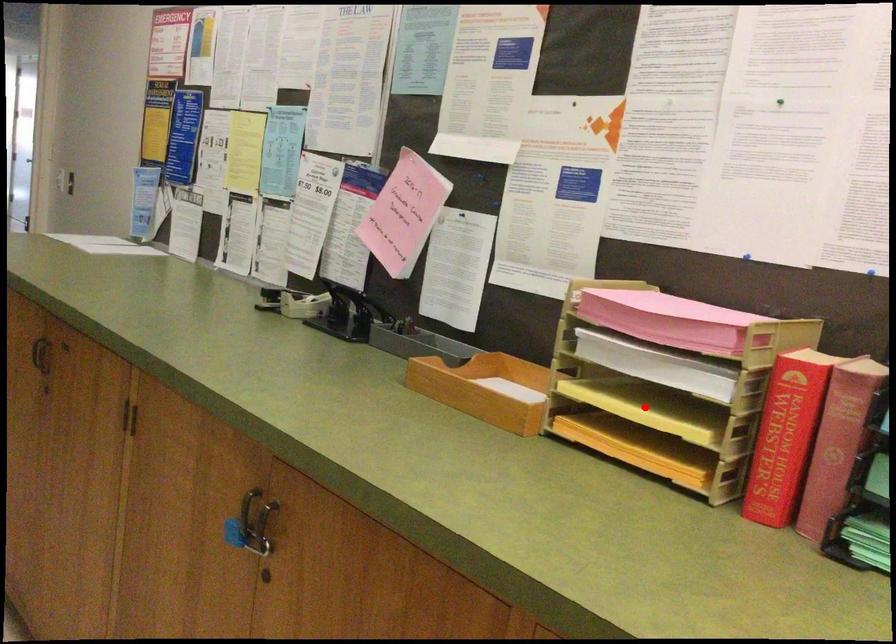
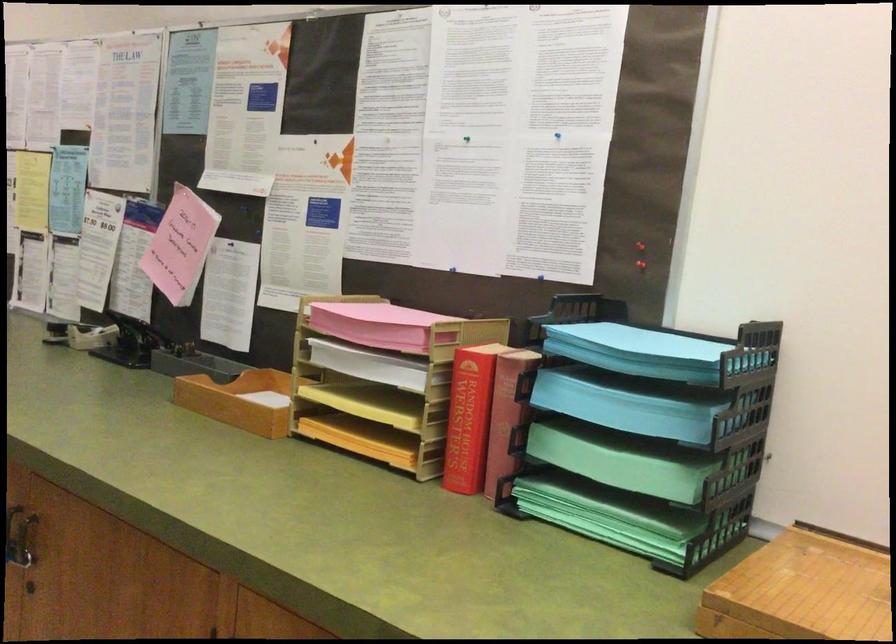
Question: I am providing you with two images of the same scene from different viewpoints. A red point is shown in image1. For the corresponding object point in image2, is it positioned nearer or farther from the camera?

Choices:
 (A) Nearer
 (B) Farther

Answer: (B)